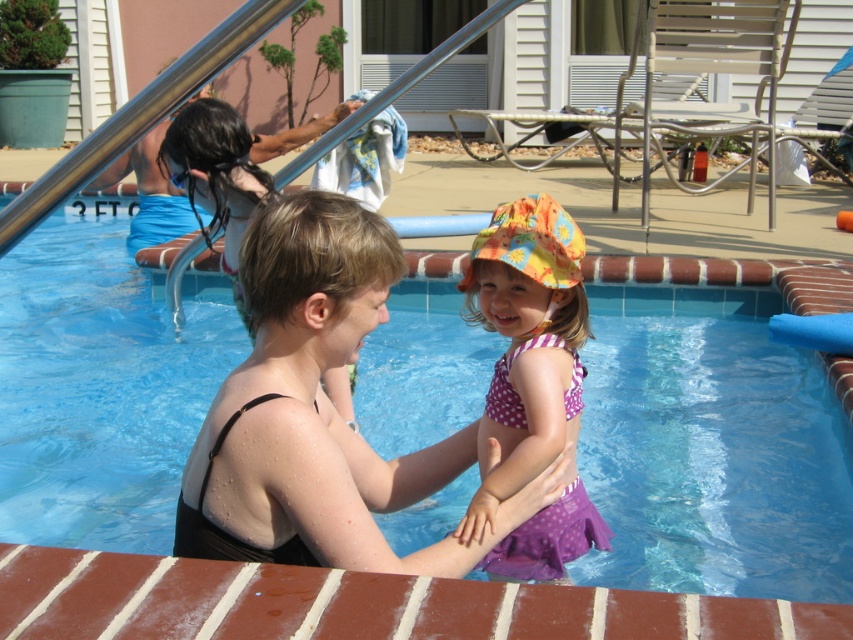
Find the location of `purple polka dot swimsuit at center`. purple polka dot swimsuit at center is located at coordinates (526, 342).

Between purple polka dot swimsuit at center and blue plastic goggles at upper left, which one appears on the right side from the viewer's perspective?

purple polka dot swimsuit at center

The width and height of the screenshot is (853, 640). I want to click on purple polka dot swimsuit at center, so click(526, 342).

Is point (131, 481) in front of point (527, 212)?

No, (131, 481) is behind (527, 212).

This screenshot has height=640, width=853. What do you see at coordinates (711, 451) in the screenshot? I see `blue tile swimming pool at center` at bounding box center [711, 451].

Locate an element on the screen. Image resolution: width=853 pixels, height=640 pixels. blue tile swimming pool at center is located at coordinates (711, 451).

Measure the distance between point (x=660, y=445) and camera.

Point (x=660, y=445) is 10.79 feet from camera.

In the scene shown: Who is more distant from viewer, (831, 426) or (177, 188)?

Positioned behind is point (177, 188).

Is point (113, 275) closer to camera compared to point (164, 161)?

No, (113, 275) is behind (164, 161).

This screenshot has width=853, height=640. Identify the location of blue tile swimming pool at center. (711, 451).